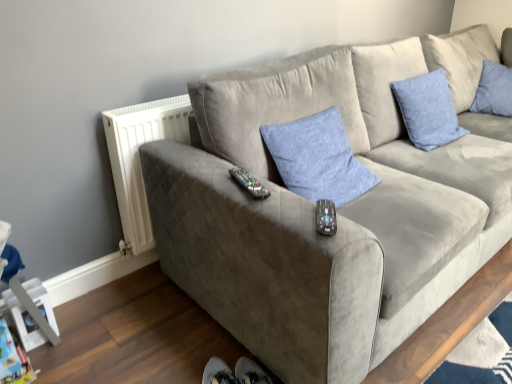
The height and width of the screenshot is (384, 512). Find the location of `suede gray couch at center`. suede gray couch at center is located at coordinates (338, 210).

Describe the element at coordinates (249, 183) in the screenshot. The height and width of the screenshot is (384, 512). I see `black plastic remote at center, which appears as the second remote when viewed from the front` at that location.

The width and height of the screenshot is (512, 384). What do you see at coordinates (326, 217) in the screenshot? I see `black plastic remote at center, which ranks as the 2th remote in top-to-bottom order` at bounding box center [326, 217].

Identify the location of blue textured pillow at upper right, which appears as the 2th pillow when viewed from the front. This screenshot has width=512, height=384. (428, 110).

Can you tell me how much black plastic remote at center, which is the first remote in top-to-bottom order, and suede gray couch at center differ in facing direction?

67.1 degrees separate the facing orientations of black plastic remote at center, which is the first remote in top-to-bottom order, and suede gray couch at center.

In the scene shown: Can you confirm if black plastic remote at center, acting as the 1th remote starting from the left, is smaller than suede gray couch at center?

Yes.

Which object is positioned more to the left, black plastic remote at center, marked as the second remote in a bottom-to-top arrangement, or suede gray couch at center?

black plastic remote at center, marked as the second remote in a bottom-to-top arrangement.

Locate an element on the screen. the 1st remote below the suede gray couch at center (from the image's perspective) is located at coordinates (249, 183).

Based on their sizes in the image, would you say blue fabric pillow at center, the first pillow in the left-to-right sequence, is bigger or smaller than black plastic remote at center, acting as the 2th remote starting from the left?

Considering their sizes, blue fabric pillow at center, the first pillow in the left-to-right sequence, takes up more space than black plastic remote at center, acting as the 2th remote starting from the left.

Which is more to the left, blue fabric pillow at center, the 2th pillow viewed from the right, or black plastic remote at center, positioned as the first remote in bottom-to-top order?

From the viewer's perspective, black plastic remote at center, positioned as the first remote in bottom-to-top order, appears more on the left side.

Can you tell me how much blue fabric pillow at center, the 2th pillow viewed from the right, and black plastic remote at center, arranged as the first remote when viewed from the front, differ in facing direction?

37.5 degrees separate the facing orientations of blue fabric pillow at center, the 2th pillow viewed from the right, and black plastic remote at center, arranged as the first remote when viewed from the front.

Is blue fabric pillow at center, marked as the 1th pillow in a front-to-back arrangement, not within black plastic remote at center, acting as the 2th remote starting from the left?

Yes.

From the image's perspective, between white plastic radiator at left and suede gray couch at center, which one is located above?

suede gray couch at center is shown above in the image.

Does white plastic radiator at left have a lesser height compared to suede gray couch at center?

Yes, white plastic radiator at left is shorter than suede gray couch at center.

Which is more to the left, white plastic radiator at left or suede gray couch at center?

From the viewer's perspective, white plastic radiator at left appears more on the left side.

Is white plastic radiator at left bigger than suede gray couch at center?

No, white plastic radiator at left is not bigger than suede gray couch at center.

From the image's perspective, which object appears higher, black plastic remote at center, which is the first remote in top-to-bottom order, or black plastic remote at center, arranged as the first remote when viewed from the front?

black plastic remote at center, which is the first remote in top-to-bottom order, appears higher in the image.

Can you confirm if black plastic remote at center, which appears as the second remote when viewed from the front, is wider than black plastic remote at center, the 1th remote positioned from the right?

Yes.

Is black plastic remote at center, acting as the 1th remote starting from the left, spatially inside black plastic remote at center, which ranks as the 2th remote in top-to-bottom order, or outside of it?

black plastic remote at center, acting as the 1th remote starting from the left, exists outside the volume of black plastic remote at center, which ranks as the 2th remote in top-to-bottom order.

Considering the relative sizes of blue textured pillow at upper right, the 1th pillow in the back-to-front sequence, and black plastic remote at center, acting as the 2th remote starting from the right, in the image provided, is blue textured pillow at upper right, the 1th pillow in the back-to-front sequence, shorter than black plastic remote at center, acting as the 2th remote starting from the right,?

No, blue textured pillow at upper right, the 1th pillow in the back-to-front sequence, is not shorter than black plastic remote at center, acting as the 2th remote starting from the right.

Which object is more forward, blue textured pillow at upper right, the second pillow when ordered from left to right, or black plastic remote at center, the first remote when ordered from back to front?

black plastic remote at center, the first remote when ordered from back to front, is in front.

Could black plastic remote at center, acting as the 2th remote starting from the right, be considered to be inside blue textured pillow at upper right, the 1th pillow in the back-to-front sequence?

No, blue textured pillow at upper right, the 1th pillow in the back-to-front sequence, does not contain black plastic remote at center, acting as the 2th remote starting from the right.

Can you confirm if blue textured pillow at upper right, the second pillow when ordered from left to right, is positioned to the left of black plastic remote at center, which is the first remote in top-to-bottom order?

Incorrect, blue textured pillow at upper right, the second pillow when ordered from left to right, is not on the left side of black plastic remote at center, which is the first remote in top-to-bottom order.

Would you say black plastic remote at center, acting as the 2th remote starting from the left, is outside blue textured pillow at upper right, the second pillow when ordered from left to right?

Yes, black plastic remote at center, acting as the 2th remote starting from the left, is not within blue textured pillow at upper right, the second pillow when ordered from left to right.

Does black plastic remote at center, positioned as the first remote in bottom-to-top order, turn towards blue textured pillow at upper right, which appears as the 2th pillow when viewed from the front?

No, black plastic remote at center, positioned as the first remote in bottom-to-top order, is not oriented towards blue textured pillow at upper right, which appears as the 2th pillow when viewed from the front.

From a real-world perspective, is black plastic remote at center, acting as the 2th remote starting from the left, on top of blue textured pillow at upper right, which appears as the 2th pillow when viewed from the front?

Yes, from a real-world perspective, black plastic remote at center, acting as the 2th remote starting from the left, is over blue textured pillow at upper right, which appears as the 2th pillow when viewed from the front

Considering the positions of objects blue fabric pillow at center, marked as the 1th pillow in a front-to-back arrangement, and black plastic remote at center, acting as the 1th remote starting from the left, in the image provided, who is in front, blue fabric pillow at center, marked as the 1th pillow in a front-to-back arrangement, or black plastic remote at center, acting as the 1th remote starting from the left,?

black plastic remote at center, acting as the 1th remote starting from the left, is in front.

Which is more to the right, blue fabric pillow at center, the 2th pillow viewed from the right, or black plastic remote at center, which appears as the second remote when viewed from the front?

blue fabric pillow at center, the 2th pillow viewed from the right, is more to the right.

From a real-world perspective, is blue fabric pillow at center, marked as the 1th pillow in a front-to-back arrangement, on black plastic remote at center, which is the first remote in top-to-bottom order?

Incorrect, from a real-world perspective, blue fabric pillow at center, marked as the 1th pillow in a front-to-back arrangement, is lower than black plastic remote at center, which is the first remote in top-to-bottom order.

What are the coordinates of `remote that is the 2nd object to the left of the blue fabric pillow at center, which appears as the 2th pillow when viewed from the back, starting at the anchor` in the screenshot? It's located at (249, 183).

Starting from the suede gray couch at center, which remote is the 2nd one behind? Please provide its 2D coordinates.

[(249, 183)]

Find the location of `remote that is the 1st object above the blue fabric pillow at center, marked as the 1th pillow in a front-to-back arrangement (from a real-world perspective)`. remote that is the 1st object above the blue fabric pillow at center, marked as the 1th pillow in a front-to-back arrangement (from a real-world perspective) is located at coordinates (326, 217).

Looking at this image, from the image, which object appears to be nearer to blue fabric pillow at center, the first pillow in the left-to-right sequence, white plastic radiator at left or blue textured pillow at upper right, the first pillow when ordered from right to left?

white plastic radiator at left.

Looking at the image, which one is located further to suede gray couch at center, blue fabric pillow at center, marked as the 1th pillow in a front-to-back arrangement, or black plastic remote at center, positioned as the first remote in bottom-to-top order?

Based on the image, black plastic remote at center, positioned as the first remote in bottom-to-top order, appears to be further to suede gray couch at center.

Looking at the image, which one is located further to black plastic remote at center, acting as the 1th remote starting from the left, suede gray couch at center or blue textured pillow at upper right, the first pillow when ordered from right to left?

The object further to black plastic remote at center, acting as the 1th remote starting from the left, is blue textured pillow at upper right, the first pillow when ordered from right to left.

Looking at the image, which one is located closer to blue textured pillow at upper right, the 1th pillow in the back-to-front sequence, white plastic radiator at left or suede gray couch at center?

suede gray couch at center is positioned closer to the anchor blue textured pillow at upper right, the 1th pillow in the back-to-front sequence.

Which object lies nearer to the anchor point suede gray couch at center, blue fabric pillow at center, marked as the 1th pillow in a front-to-back arrangement, or blue textured pillow at upper right, the 1th pillow in the back-to-front sequence?

Based on the image, blue fabric pillow at center, marked as the 1th pillow in a front-to-back arrangement, appears to be nearer to suede gray couch at center.

Based on their spatial positions, is black plastic remote at center, acting as the 1th remote starting from the left, or blue fabric pillow at center, the first pillow in the left-to-right sequence, further from blue textured pillow at upper right, the 1th pillow in the back-to-front sequence?

black plastic remote at center, acting as the 1th remote starting from the left.

Based on their spatial positions, is black plastic remote at center, which appears as the second remote when viewed from the front, or suede gray couch at center closer to blue fabric pillow at center, the first pillow in the left-to-right sequence?

suede gray couch at center is closer to blue fabric pillow at center, the first pillow in the left-to-right sequence.

From the picture: Based on their spatial positions, is suede gray couch at center or blue textured pillow at upper right, the second pillow when ordered from left to right, closer to blue fabric pillow at center, the first pillow in the left-to-right sequence?

suede gray couch at center is closer to blue fabric pillow at center, the first pillow in the left-to-right sequence.

Identify the location of remote between black plastic remote at center, acting as the 1th remote starting from the left, and blue textured pillow at upper right, which appears as the 2th pillow when viewed from the front, in the horizontal direction. (326, 217).

The image size is (512, 384). What are the coordinates of `pillow situated between white plastic radiator at left and blue textured pillow at upper right, which appears as the 2th pillow when viewed from the front, from left to right` in the screenshot? It's located at (318, 158).

Where is `remote between white plastic radiator at left and black plastic remote at center, acting as the 2th remote starting from the left, in the horizontal direction`? The width and height of the screenshot is (512, 384). remote between white plastic radiator at left and black plastic remote at center, acting as the 2th remote starting from the left, in the horizontal direction is located at coordinates pos(249,183).

You are a GUI agent. You are given a task and a screenshot of the screen. Output one action in this format:
    pyautogui.click(x=<x>, y=<y>)
    Task: Click on the pillow between suede gray couch at center and blue textured pillow at upper right, the second pillow when ordered from left to right, along the z-axis
    
    Given the screenshot: What is the action you would take?
    pyautogui.click(x=318, y=158)